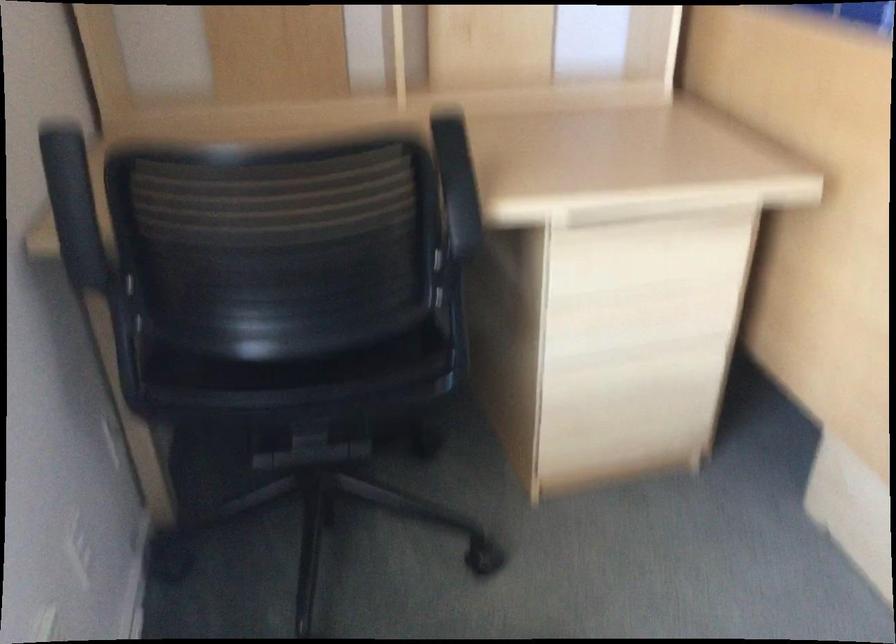
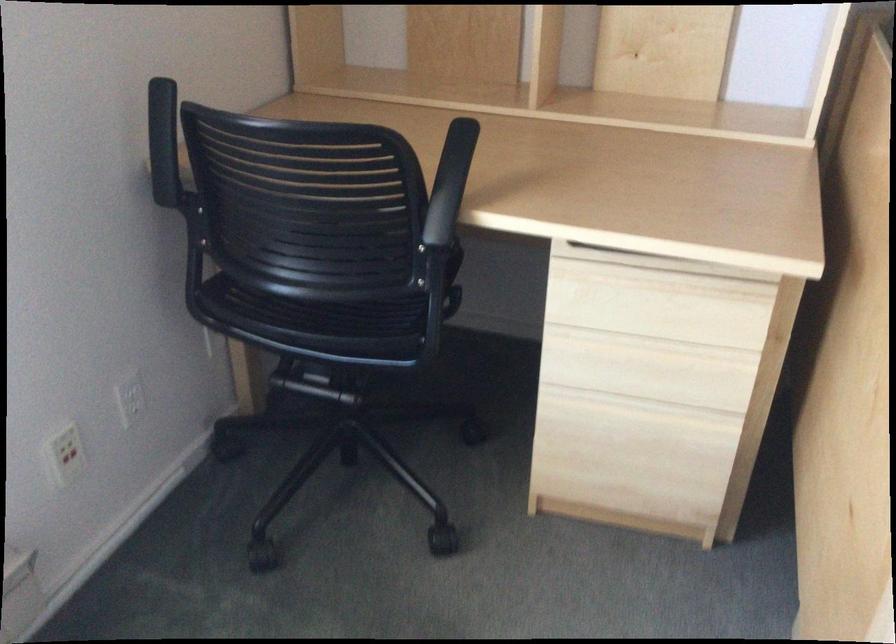
Where in the second image is the point corresponding to (467,176) from the first image?

(450, 183)